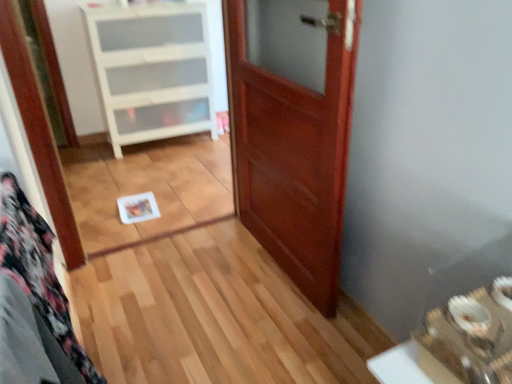
Where is `mahogany wood door at center`? Image resolution: width=512 pixels, height=384 pixels. mahogany wood door at center is located at coordinates (293, 130).

This screenshot has width=512, height=384. What do you see at coordinates (293, 130) in the screenshot?
I see `mahogany wood door at center` at bounding box center [293, 130].

What is the approximate height of mahogany wood door at center?

mahogany wood door at center is 3.86 feet tall.

Where is `white plastic cabinet at upper left`? This screenshot has height=384, width=512. white plastic cabinet at upper left is located at coordinates [x=152, y=71].

The image size is (512, 384). What do you see at coordinates (152, 71) in the screenshot?
I see `white plastic cabinet at upper left` at bounding box center [152, 71].

What is the approximate height of white plastic cabinet at upper left?

98.56 centimeters.

Locate an element on the screen. This screenshot has width=512, height=384. mahogany wood door at center is located at coordinates (293, 130).

Consider the image. Can you confirm if mahogany wood door at center is positioned to the left of white plastic cabinet at upper left?

In fact, mahogany wood door at center is to the right of white plastic cabinet at upper left.

Which object is closer to the camera, mahogany wood door at center or white plastic cabinet at upper left?

mahogany wood door at center is more forward.

Is point (294, 271) closer to camera compared to point (117, 55)?

Yes, it is in front of point (117, 55).

From the image's perspective, between mahogany wood door at center and white plastic cabinet at upper left, which one is located above?

white plastic cabinet at upper left.

From a real-world perspective, is mahogany wood door at center positioned above or below white plastic cabinet at upper left?

mahogany wood door at center is above white plastic cabinet at upper left.

Which object is wider, mahogany wood door at center or white plastic cabinet at upper left?

With larger width is white plastic cabinet at upper left.

Considering the sizes of objects mahogany wood door at center and white plastic cabinet at upper left in the image provided, who is taller, mahogany wood door at center or white plastic cabinet at upper left?

mahogany wood door at center is taller.

Does mahogany wood door at center have a larger size compared to white plastic cabinet at upper left?

Actually, mahogany wood door at center might be smaller than white plastic cabinet at upper left.

Based on the photo, is white plastic cabinet at upper left inside mahogany wood door at center?

No, white plastic cabinet at upper left is not inside mahogany wood door at center.

Are mahogany wood door at center and white plastic cabinet at upper left making contact?

No, mahogany wood door at center is not making contact with white plastic cabinet at upper left.

Could you tell me if mahogany wood door at center is facing white plastic cabinet at upper left?

No, mahogany wood door at center does not turn towards white plastic cabinet at upper left.

Where is `cabinetry that is under the mahogany wood door at center (from a real-world perspective)`? Image resolution: width=512 pixels, height=384 pixels. cabinetry that is under the mahogany wood door at center (from a real-world perspective) is located at coordinates (152, 71).

Is white plastic cabinet at upper left to the left of mahogany wood door at center from the viewer's perspective?

Yes, white plastic cabinet at upper left is to the left of mahogany wood door at center.

From the picture: Relative to mahogany wood door at center, is white plastic cabinet at upper left in front or behind?

Visually, white plastic cabinet at upper left is located behind mahogany wood door at center.

Is point (138, 6) positioned in front of point (337, 220)?

No.

From the image's perspective, which one is positioned higher, white plastic cabinet at upper left or mahogany wood door at center?

white plastic cabinet at upper left appears higher in the image.

From a real-world perspective, which object rests below the other?

white plastic cabinet at upper left, from a real-world perspective.

Looking at their sizes, would you say white plastic cabinet at upper left is wider or thinner than mahogany wood door at center?

Clearly, white plastic cabinet at upper left has more width compared to mahogany wood door at center.

Is white plastic cabinet at upper left taller than mahogany wood door at center?

Incorrect, the height of white plastic cabinet at upper left is not larger of that of mahogany wood door at center.

Can you confirm if white plastic cabinet at upper left is bigger than mahogany wood door at center?

Yes, white plastic cabinet at upper left is bigger than mahogany wood door at center.

Based on the photo, is white plastic cabinet at upper left completely or partially outside of mahogany wood door at center?

Absolutely, white plastic cabinet at upper left is external to mahogany wood door at center.

Would you consider white plastic cabinet at upper left to be distant from mahogany wood door at center?

Yes.

Is white plastic cabinet at upper left facing towards mahogany wood door at center?

Yes, white plastic cabinet at upper left is turned towards mahogany wood door at center.

Can you tell me how much white plastic cabinet at upper left and mahogany wood door at center differ in facing direction?

They differ by 88.7 degrees in their facing directions.

In order to click on door that appears below the white plastic cabinet at upper left (from the image's perspective) in this screenshot , I will do `click(293, 130)`.

There is a white plastic cabinet at upper left. At what (x,y) coordinates should I click in order to perform the action: click on door above it (from a real-world perspective). Please return your answer as a coordinate pair (x, y). The width and height of the screenshot is (512, 384). Looking at the image, I should click on (293, 130).

At what (x,y) coordinates should I click in order to perform the action: click on cabinetry to the left of mahogany wood door at center. Please return your answer as a coordinate pair (x, y). Looking at the image, I should click on (152, 71).